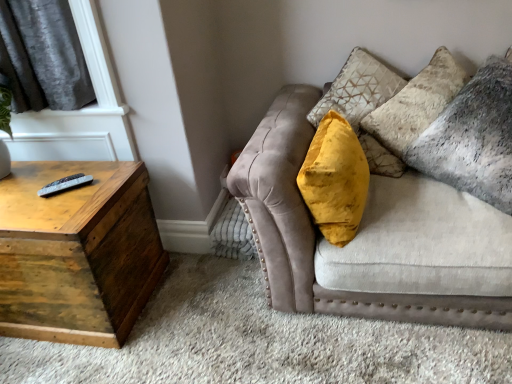
Question: Is velvet beige couch at upper right further to camera compared to velvet gray pillow at upper right?

Choices:
 (A) yes
 (B) no

Answer: (B)

Question: From a real-world perspective, does velvet beige couch at upper right stand above velvet gray pillow at upper right?

Choices:
 (A) no
 (B) yes

Answer: (A)

Question: Is there a large distance between velvet beige couch at upper right and velvet gray pillow at upper right?

Choices:
 (A) yes
 (B) no

Answer: (B)

Question: From the image's perspective, is velvet beige couch at upper right located beneath velvet gray pillow at upper right?

Choices:
 (A) yes
 (B) no

Answer: (A)

Question: Is velvet beige couch at upper right at the left side of velvet gray pillow at upper right?

Choices:
 (A) yes
 (B) no

Answer: (A)

Question: Is velvet beige couch at upper right looking in the opposite direction of velvet gray pillow at upper right?

Choices:
 (A) yes
 (B) no

Answer: (A)

Question: Is black plastic remote at left beside wooden trunk at left?

Choices:
 (A) yes
 (B) no

Answer: (B)

Question: From a real-world perspective, is black plastic remote at left on top of wooden trunk at left?

Choices:
 (A) yes
 (B) no

Answer: (A)

Question: Considering the relative sizes of black plastic remote at left and wooden trunk at left in the image provided, is black plastic remote at left taller than wooden trunk at left?

Choices:
 (A) no
 (B) yes

Answer: (A)

Question: Considering the relative sizes of black plastic remote at left and wooden trunk at left in the image provided, is black plastic remote at left shorter than wooden trunk at left?

Choices:
 (A) no
 (B) yes

Answer: (B)

Question: Is black plastic remote at left thinner than wooden trunk at left?

Choices:
 (A) no
 (B) yes

Answer: (B)

Question: Are black plastic remote at left and wooden trunk at left located far from each other?

Choices:
 (A) yes
 (B) no

Answer: (B)

Question: Is wooden trunk at left to the right of black plastic remote at left from the viewer's perspective?

Choices:
 (A) no
 (B) yes

Answer: (A)